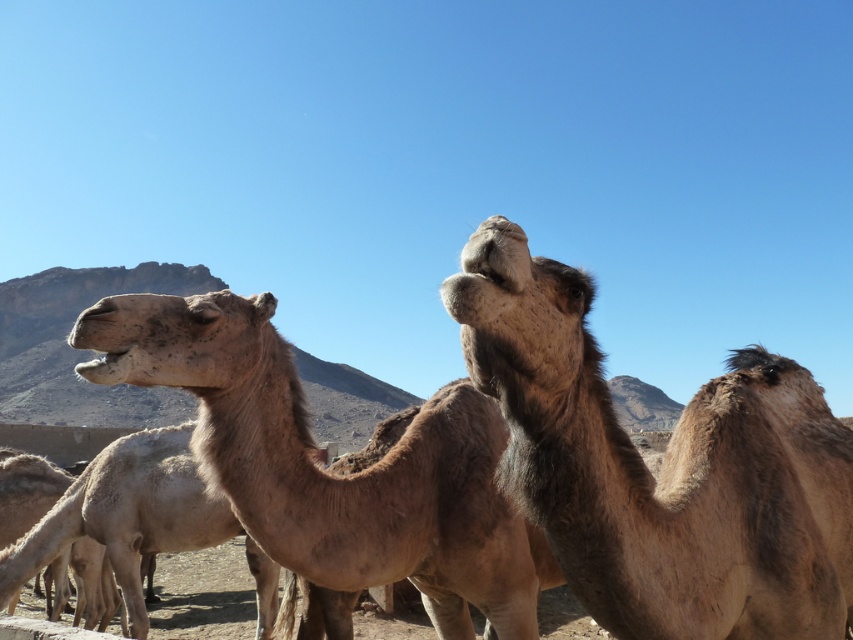
Consider the image. You are a photographer standing in the desert and want to take a photo of the brown fuzzy camel at upper right. If your camera can focus on objects up to 36 inches away, will you need to move closer or farther away to get a clear shot?

The brown fuzzy camel at upper right is 36.44 inches away from you. Since your camera can focus up to 36 inches, you need to move slightly farther away to ensure it falls within the camera range.

You are a photographer trying to capture a clear photo of the brown fuzzy camel at upper right. However, the brown fuzzy camel at center is blocking your view. Can you move to the side to get a better shot without moving the camels?

The brown fuzzy camel at upper right is behind the brown fuzzy camel at center, so moving to the side might allow you to see around the camel at center and capture the camel at upper right.